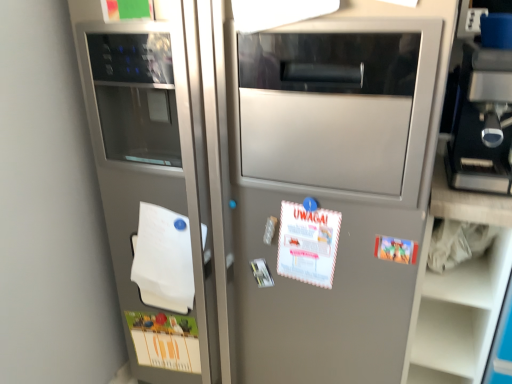
Question: Considering the relative positions of white matte notepad at left and white paper at center, which is counted as the 3th postcard, starting from the bottom, in the image provided, is white matte notepad at left to the left of white paper at center, which is counted as the 3th postcard, starting from the bottom, from the viewer's perspective?

Choices:
 (A) no
 (B) yes

Answer: (B)

Question: Is white matte notepad at left to the right of white paper at center, arranged as the second postcard when viewed from the left, from the viewer's perspective?

Choices:
 (A) no
 (B) yes

Answer: (A)

Question: Is white matte notepad at left placed right next to white paper at center, which ranks as the second postcard in right-to-left order?

Choices:
 (A) no
 (B) yes

Answer: (A)

Question: Is white matte notepad at left thinner than white paper at center, the first postcard when ordered from top to bottom?

Choices:
 (A) no
 (B) yes

Answer: (A)

Question: Does white matte notepad at left turn towards white paper at center, arranged as the second postcard when viewed from the left?

Choices:
 (A) yes
 (B) no

Answer: (B)

Question: From a real-world perspective, is matte paper postcard at lower left, arranged as the first postcard when viewed from the left, above or below white paper at center, arranged as the second postcard when viewed from the left?

Choices:
 (A) below
 (B) above

Answer: (A)

Question: Based on their sizes in the image, would you say matte paper postcard at lower left, which is counted as the 1th postcard, starting from the bottom, is bigger or smaller than white paper at center, which ranks as the second postcard in right-to-left order?

Choices:
 (A) small
 (B) big

Answer: (B)

Question: Based on their positions, is matte paper postcard at lower left, acting as the third postcard starting from the front, located to the left or right of white paper at center, which ranks as the second postcard in right-to-left order?

Choices:
 (A) right
 (B) left

Answer: (B)

Question: Considering their positions, is matte paper postcard at lower left, the 1th postcard when ordered from back to front, located in front of or behind white paper at center, the first postcard when ordered from top to bottom?

Choices:
 (A) behind
 (B) front

Answer: (A)

Question: Considering the positions of white matte notepad at left and matte paper postcard at lower left, the 1th postcard when ordered from back to front, in the image, is white matte notepad at left taller or shorter than matte paper postcard at lower left, the 1th postcard when ordered from back to front,?

Choices:
 (A) short
 (B) tall

Answer: (B)

Question: Choose the correct answer: Is white matte notepad at left inside matte paper postcard at lower left, arranged as the first postcard when viewed from the left, or outside it?

Choices:
 (A) outside
 (B) inside

Answer: (A)

Question: Is point (138, 238) closer or farther from the camera than point (194, 339)?

Choices:
 (A) farther
 (B) closer

Answer: (B)

Question: In terms of width, does white matte notepad at left look wider or thinner when compared to matte paper postcard at lower left, the 3th postcard in the top-to-bottom sequence?

Choices:
 (A) thin
 (B) wide

Answer: (B)

Question: Considering the positions of matte plastic postcard at right, arranged as the second postcard when ordered from the bottom, and white paper at center, which is counted as the 3th postcard, starting from the bottom, in the image, is matte plastic postcard at right, arranged as the second postcard when ordered from the bottom, wider or thinner than white paper at center, which is counted as the 3th postcard, starting from the bottom,?

Choices:
 (A) thin
 (B) wide

Answer: (A)

Question: Which is correct: matte plastic postcard at right, which ranks as the third postcard in back-to-front order, is inside white paper at center, the first postcard when ordered from top to bottom, or outside of it?

Choices:
 (A) inside
 (B) outside

Answer: (B)